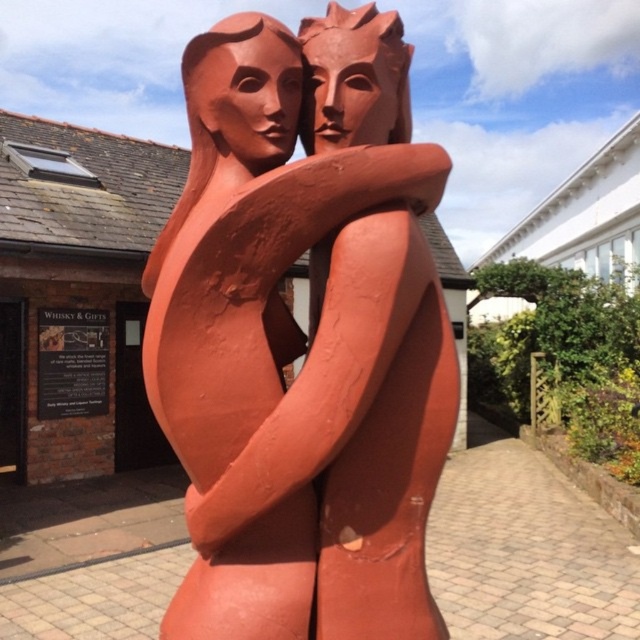
You are an art student analyzing the sculpture. You notice the terracotta statue at center and the matte terracotta head at upper center. Which object is taller?

The terracotta statue at center is much taller than the matte terracotta head at upper center.

In the scene shown: You are an art student analyzing the sculpture in the image. You observe the terracotta statue at center and the matte terracotta head at center. Which object has a greater width?

The terracotta statue at center might be wider than matte terracotta head at center, so the terracotta statue at center likely has a greater width.